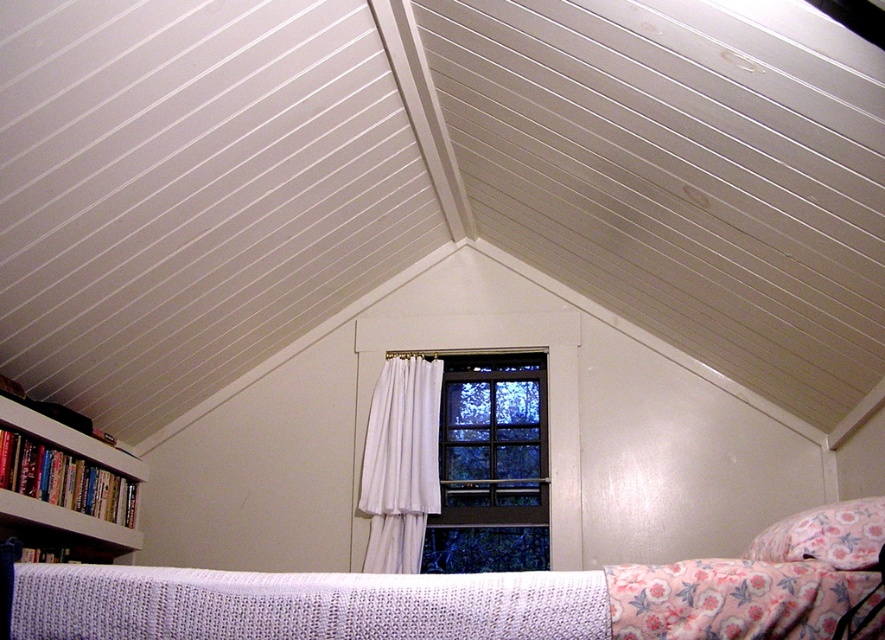
Question: Does wooden bookshelf at left have a smaller size compared to floral fabric pillow at lower right?

Choices:
 (A) yes
 (B) no

Answer: (B)

Question: Which of these objects is positioned farthest from the wooden bookshelf at left?

Choices:
 (A) white sheer curtain at center
 (B) clear glass window at center
 (C) white knitted bed at center

Answer: (C)

Question: Which point is farther from the camera taking this photo?

Choices:
 (A) (537, 541)
 (B) (764, 531)

Answer: (A)

Question: Based on their relative distances, which object is nearer to the wooden bookshelf at left?

Choices:
 (A) white knitted bed at center
 (B) floral fabric pillow at lower right
 (C) clear glass window at center

Answer: (C)

Question: Does white knitted bed at center appear under clear glass window at center?

Choices:
 (A) no
 (B) yes

Answer: (A)

Question: Is white knitted bed at center positioned at the back of wooden bookshelf at left?

Choices:
 (A) no
 (B) yes

Answer: (A)